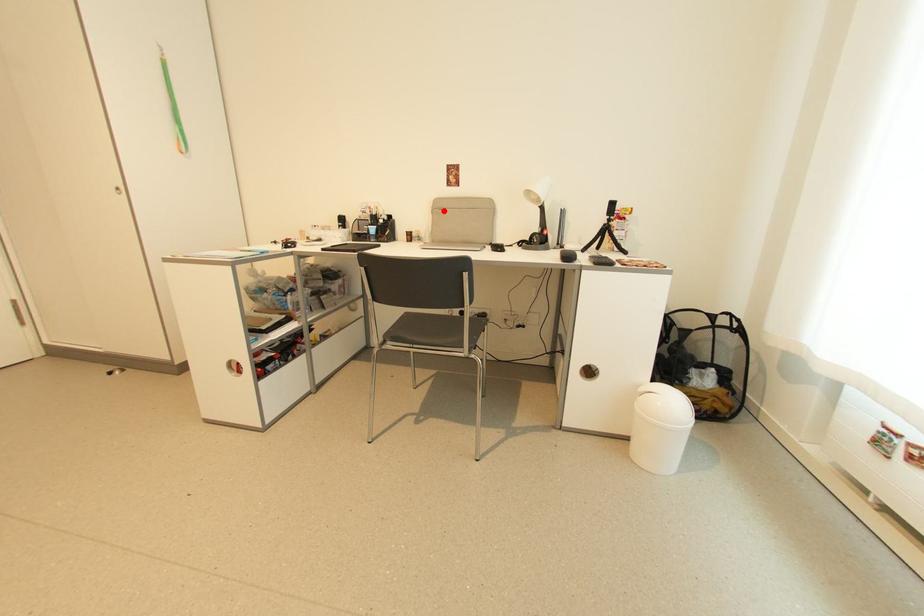
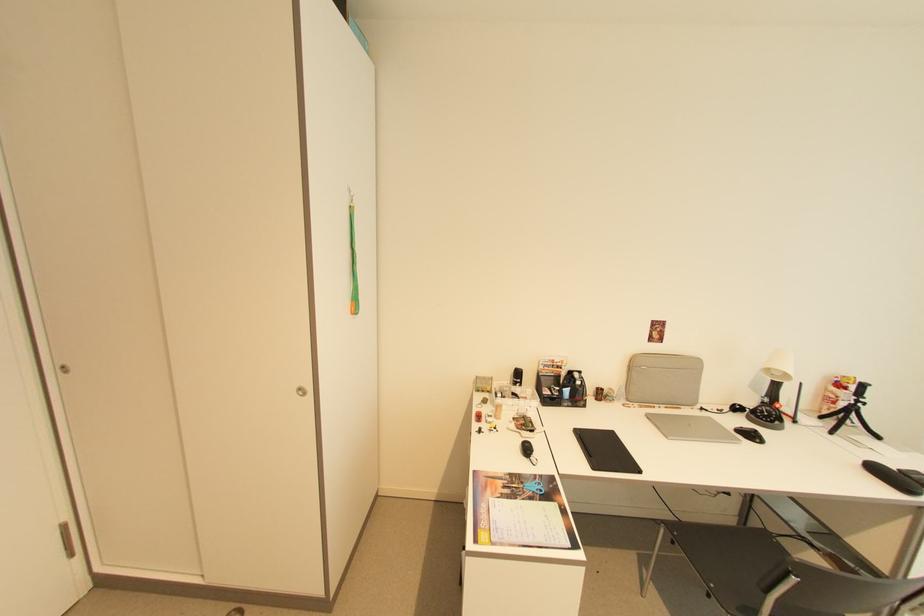
Locate, in the second image, the point that corresponds to the highlighted location in the first image.

(638, 366)